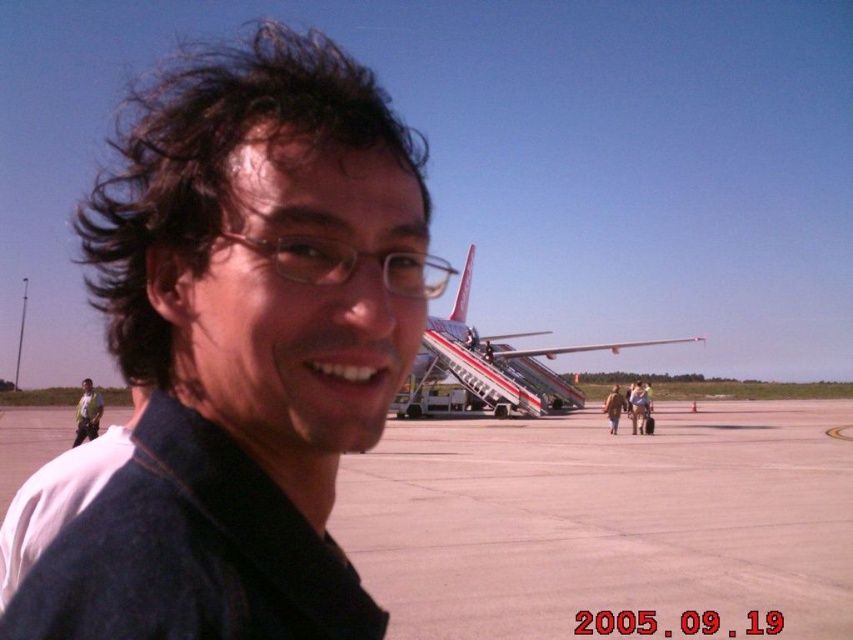
You are a photographer standing at the airport tarmac. You want to take a photo of the matte black shirt at left without the white painted fuselage at center appearing in the foreground. Is this possible?

The white painted fuselage at center is positioned over the matte black shirt at left, so it would block the view. Therefore, you cannot take a photo of the matte black shirt at left without the white painted fuselage at center appearing in the foreground.

You are a photographer positioned at the airport tarmac. You want to take a photo of the matte black shirt at left without the white painted fuselage at center blocking it. How should you adjust your position?

Move to the left side so that the matte black shirt at left becomes visible without obstruction from the white painted fuselage at center.